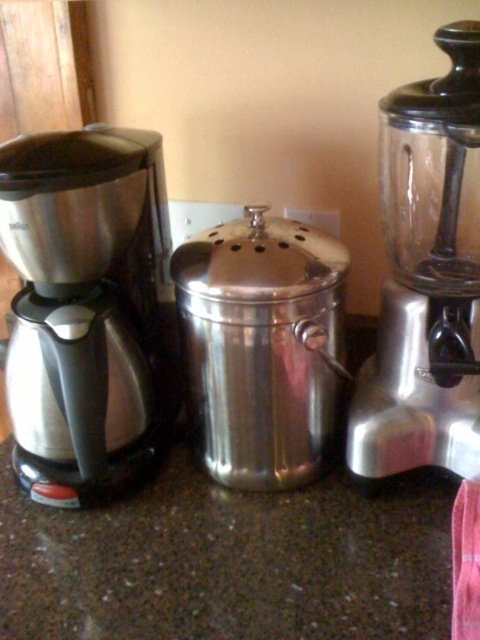
You are standing in a kitchen and see a point marked at coordinates (x=84, y=305) on the countertop. Which appliance is located at that point?

The point at coordinates (x=84, y=305) corresponds to the brushed metal coffee maker at left.

From the picture: You are standing in the kitchen and want to reach the brushed metal coffee maker at left to make coffee. Can you comfortably reach it if your arm can extend 22 inches?

The distance between you and the brushed metal coffee maker at left is 22.25 inches, which is slightly beyond your arm extension of 22 inches. You might need to take a small step forward to comfortably reach it.

You are organizing the kitchen and need to move the satin silver blender at right closer to the front. Currently, it is positioned behind the brushed metal coffee maker at left. Can you move it forward without moving the coffee maker?

The satin silver blender at right is behind the brushed metal coffee maker at left, so you can move it forward to the front by sliding it out from behind the coffee maker without needing to move the coffee maker itself.